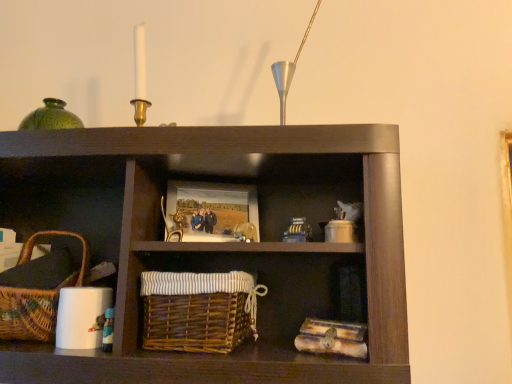
The height and width of the screenshot is (384, 512). I want to click on wooden picture frame at center, so click(212, 212).

Identify the location of wooden picture frame at center. The image size is (512, 384). (212, 212).

Considering the sizes of brown wicker basket at center and wooden picture frame at center in the image, is brown wicker basket at center wider or thinner than wooden picture frame at center?

In the image, brown wicker basket at center appears to be wider than wooden picture frame at center.

Considering the relative positions of brown wicker basket at center and wooden picture frame at center in the image provided, is brown wicker basket at center to the left of wooden picture frame at center from the viewer's perspective?

Correct, you'll find brown wicker basket at center to the left of wooden picture frame at center.

Is brown wicker basket at center spatially inside wooden picture frame at center, or outside of it?

brown wicker basket at center is located beyond the bounds of wooden picture frame at center.

I want to click on picnic basket lying in front of the wooden picture frame at center, so click(28, 314).

Is woven brown picnic basket at lower left next to wooden picture frame at center and touching it?

There is a gap between woven brown picnic basket at lower left and wooden picture frame at center.

From the image's perspective, is woven brown picnic basket at lower left on wooden picture frame at center?

Incorrect, from the image's perspective, woven brown picnic basket at lower left is lower than wooden picture frame at center.

Who is taller, woven brown picnic basket at lower left or wooden picture frame at center?

woven brown picnic basket at lower left is taller.

Is brown wicker basket at center oriented towards woven brown picnic basket at lower left?

No, brown wicker basket at center does not turn towards woven brown picnic basket at lower left.

From the picture: From a real-world perspective, which is physically above, brown wicker basket at center or woven brown picnic basket at lower left?

woven brown picnic basket at lower left is physically above.

Considering the relative positions of brown wicker basket at center and woven brown picnic basket at lower left in the image provided, is brown wicker basket at center to the left or to the right of woven brown picnic basket at lower left?

From the image, it's evident that brown wicker basket at center is to the right of woven brown picnic basket at lower left.

The image size is (512, 384). I want to click on picnic basket on the left side of brown wicker basket at center, so click(28, 314).

Is wooden picture frame at center situated inside woven brown picnic basket at lower left or outside?

wooden picture frame at center is spatially situated outside woven brown picnic basket at lower left.

Considering the sizes of objects wooden picture frame at center and woven brown picnic basket at lower left in the image provided, who is smaller, wooden picture frame at center or woven brown picnic basket at lower left?

With smaller size is wooden picture frame at center.

Is wooden picture frame at center wider than woven brown picnic basket at lower left?

In fact, wooden picture frame at center might be narrower than woven brown picnic basket at lower left.

From a real-world perspective, is wooden picture frame at center positioned under woven brown picnic basket at lower left based on gravity?

No, from a real-world perspective, wooden picture frame at center is not beneath woven brown picnic basket at lower left.

Is woven brown picnic basket at lower left beside brown wicker basket at center?

No, woven brown picnic basket at lower left is not with brown wicker basket at center.

Between woven brown picnic basket at lower left and brown wicker basket at center, which one has smaller size?

brown wicker basket at center is smaller.

Considering the points (36, 331) and (176, 299), which point is behind, point (36, 331) or point (176, 299)?

The point (36, 331) is farther from the camera.

What's the angular difference between wooden picture frame at center and brown wicker basket at center's facing directions?

There is a 23.5-degree angle between the facing directions of wooden picture frame at center and brown wicker basket at center.

Are wooden picture frame at center and brown wicker basket at center far apart?

No.

Is wooden picture frame at center oriented away from brown wicker basket at center?

No, wooden picture frame at center's orientation is not away from brown wicker basket at center.

Considering the sizes of wooden picture frame at center and brown wicker basket at center in the image, is wooden picture frame at center taller or shorter than brown wicker basket at center?

In the image, wooden picture frame at center appears to be shorter than brown wicker basket at center.

The image size is (512, 384). In order to click on basket on the left of the wooden picture frame at center in this screenshot , I will do [x=199, y=310].

Where is `picnic basket in front of the wooden picture frame at center`? This screenshot has height=384, width=512. picnic basket in front of the wooden picture frame at center is located at coordinates (28, 314).

Looking at the image, which one is located further to woven brown picnic basket at lower left, brown wicker basket at center or wooden picture frame at center?

wooden picture frame at center is further to woven brown picnic basket at lower left.

Based on their spatial positions, is wooden picture frame at center or woven brown picnic basket at lower left further from brown wicker basket at center?

woven brown picnic basket at lower left.

From the image, which object appears to be nearer to wooden picture frame at center, brown wicker basket at center or woven brown picnic basket at lower left?

brown wicker basket at center is closer to wooden picture frame at center.

Based on their spatial positions, is wooden picture frame at center or brown wicker basket at center further from woven brown picnic basket at lower left?

wooden picture frame at center lies further to woven brown picnic basket at lower left than the other object.

In the scene shown: Based on their spatial positions, is woven brown picnic basket at lower left or wooden picture frame at center closer to brown wicker basket at center?

wooden picture frame at center lies closer to brown wicker basket at center than the other object.

Consider the image. When comparing their distances from wooden picture frame at center, does woven brown picnic basket at lower left or brown wicker basket at center seem closer?

Based on the image, brown wicker basket at center appears to be nearer to wooden picture frame at center.

This screenshot has width=512, height=384. I want to click on basket between woven brown picnic basket at lower left and wooden picture frame at center in the horizontal direction, so click(x=199, y=310).